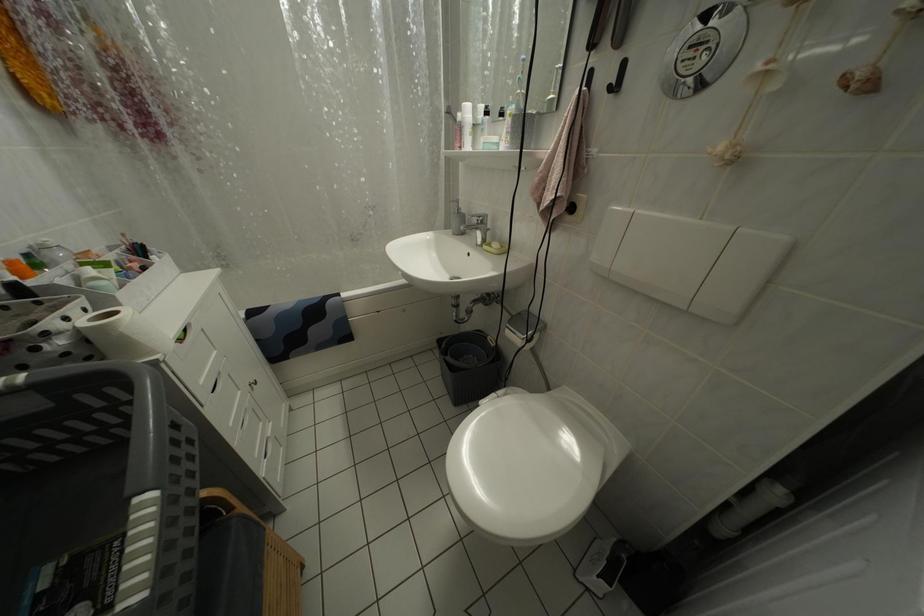
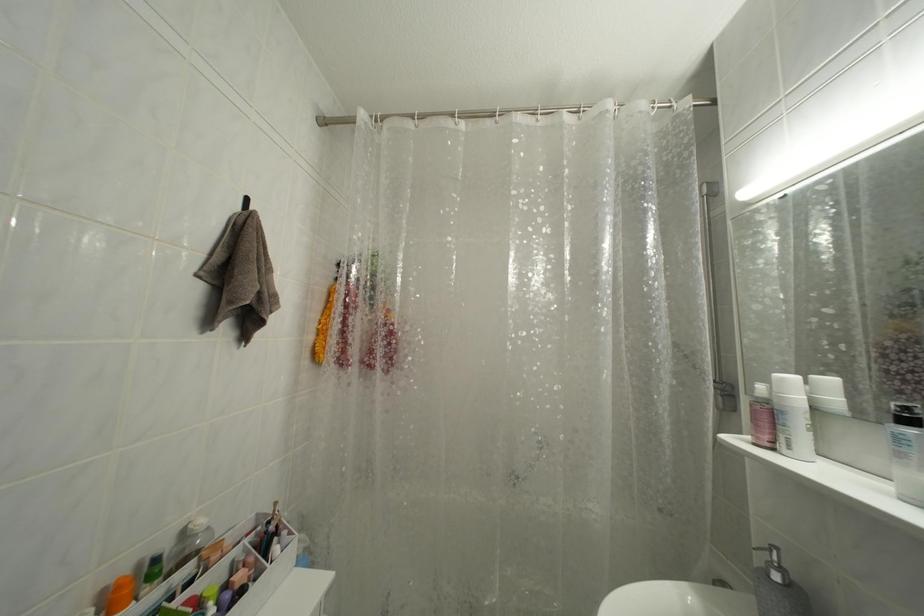
Based on the continuous images, in which direction is the camera rotating?

The rotation direction of the camera is left-up.